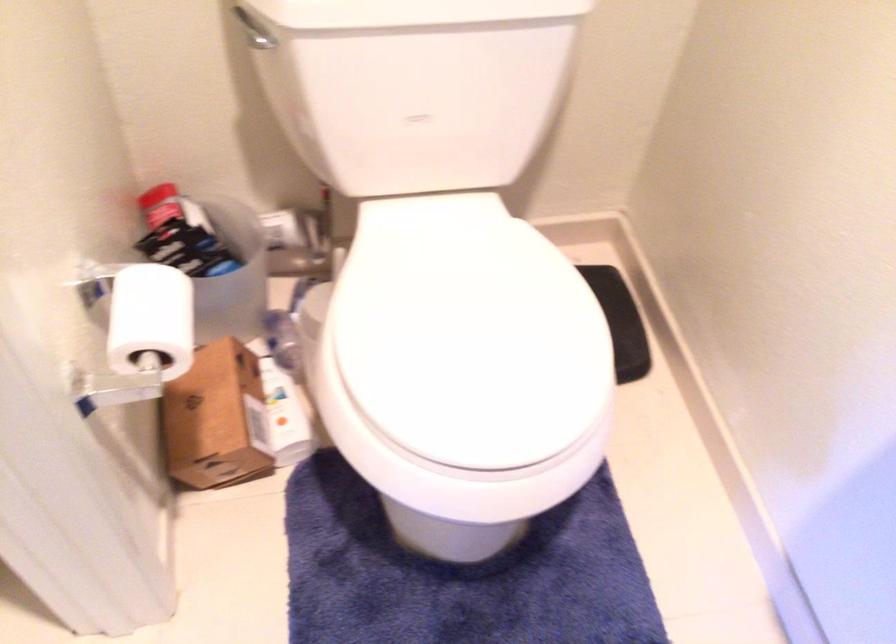
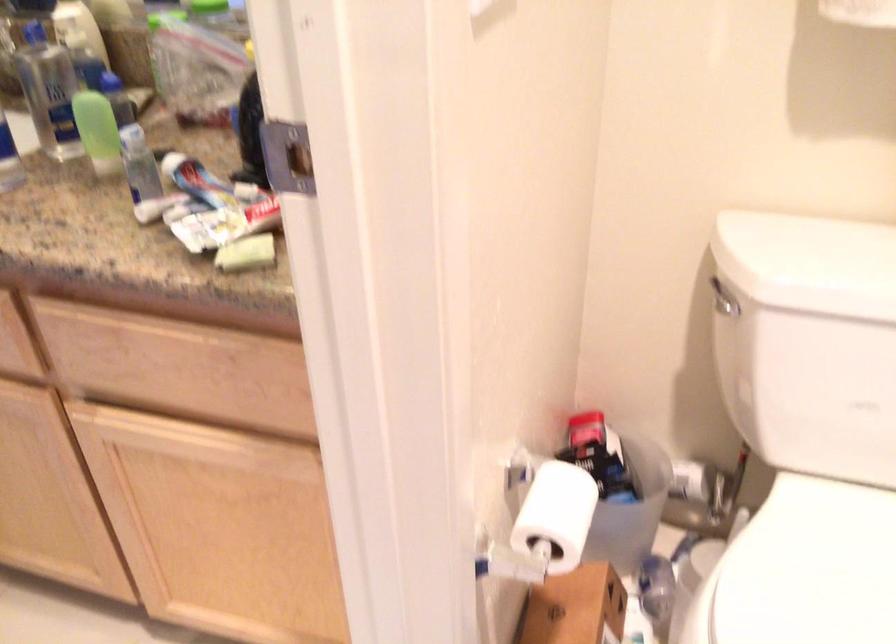
Find the pixel in the second image that matches the point at 216,386 in the first image.

(574, 608)